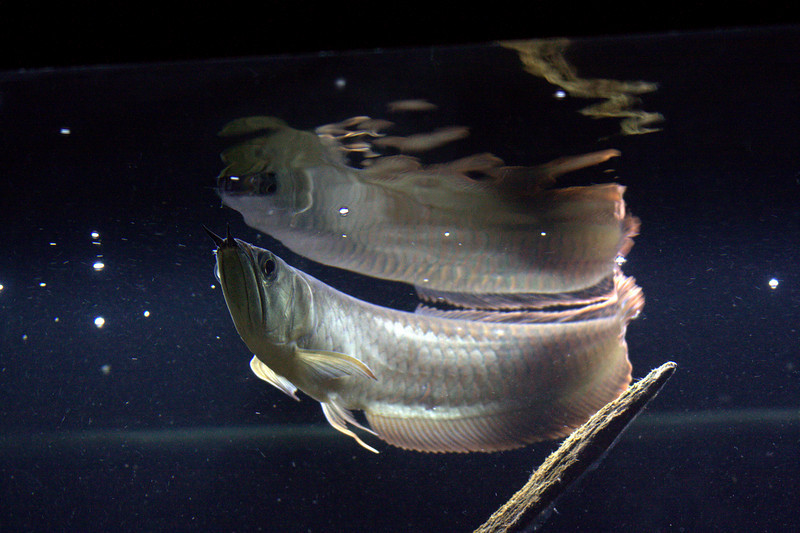
Find the location of a particular element. scales is located at coordinates (493, 379).